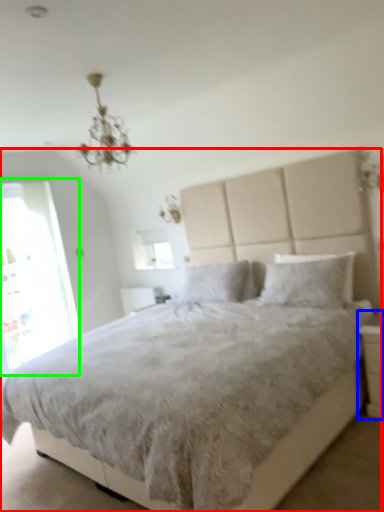
Question: Considering the real-world distances, which object is farthest from bed (highlighted by a red box)? nightstand (highlighted by a blue box) or glass door (highlighted by a green box)?

Choices:
 (A) nightstand
 (B) glass door

Answer: (A)